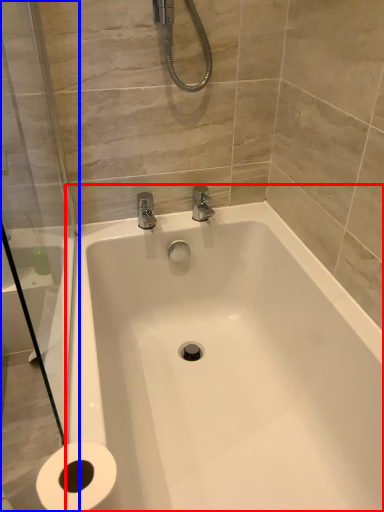
Question: Which object appears farthest to the camera in this image, bathtub (highlighted by a red box) or shower door (highlighted by a blue box)?

Choices:
 (A) bathtub
 (B) shower door

Answer: (A)